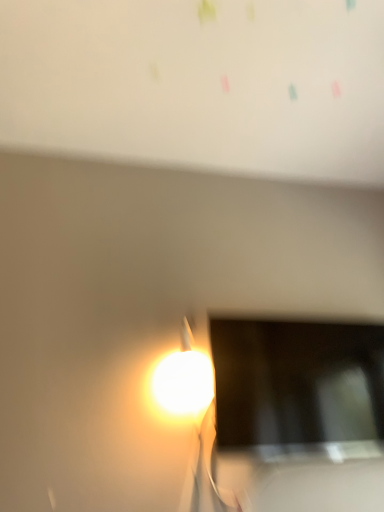
Measure the distance between point (322, 358) and camera.

Point (322, 358) and camera are 4.59 feet apart from each other.

What do you see at coordinates (296, 382) in the screenshot?
I see `matte black screen at lower right` at bounding box center [296, 382].

The width and height of the screenshot is (384, 512). Identify the location of matte black screen at lower right. (296, 382).

What do you see at coordinates (199, 84) in the screenshot? The image size is (384, 512). I see `white matte bulletin board at upper center` at bounding box center [199, 84].

Where is `white matte bulletin board at upper center`? This screenshot has height=512, width=384. white matte bulletin board at upper center is located at coordinates (199, 84).

Find the location of a particular element. matte black screen at lower right is located at coordinates [296, 382].

Does white matte bulletin board at upper center appear on the right side of matte black screen at lower right?

In fact, white matte bulletin board at upper center is to the left of matte black screen at lower right.

Looking at this image, considering their positions, is white matte bulletin board at upper center located in front of or behind matte black screen at lower right?

Clearly, white matte bulletin board at upper center is in front of matte black screen at lower right.

Which is nearer, (96, 147) or (303, 410)?

Positioned in front is point (303, 410).

From the image's perspective, which object appears higher, white matte bulletin board at upper center or matte black screen at lower right?

white matte bulletin board at upper center.

From a real-world perspective, which object rests below the other?

matte black screen at lower right, from a real-world perspective.

Between white matte bulletin board at upper center and matte black screen at lower right, which one has larger width?

Wider between the two is white matte bulletin board at upper center.

Consider the image. Considering the sizes of objects white matte bulletin board at upper center and matte black screen at lower right in the image provided, who is taller, white matte bulletin board at upper center or matte black screen at lower right?

matte black screen at lower right.

Does white matte bulletin board at upper center have a larger size compared to matte black screen at lower right?

Yes.

Would you say white matte bulletin board at upper center is inside or outside matte black screen at lower right?

white matte bulletin board at upper center is spatially situated outside matte black screen at lower right.

Does white matte bulletin board at upper center touch matte black screen at lower right?

white matte bulletin board at upper center and matte black screen at lower right are clearly separated.

Does white matte bulletin board at upper center turn towards matte black screen at lower right?

No, white matte bulletin board at upper center is not aimed at matte black screen at lower right.

How different are the orientations of white matte bulletin board at upper center and matte black screen at lower right in degrees?

white matte bulletin board at upper center and matte black screen at lower right are facing 90.2 degrees away from each other.

Locate an element on the screen. The height and width of the screenshot is (512, 384). bulletin board lying on the left of matte black screen at lower right is located at coordinates (199, 84).

Which object is positioned more to the left, matte black screen at lower right or white matte bulletin board at upper center?

From the viewer's perspective, white matte bulletin board at upper center appears more on the left side.

Considering the positions of objects matte black screen at lower right and white matte bulletin board at upper center in the image provided, who is behind, matte black screen at lower right or white matte bulletin board at upper center?

matte black screen at lower right is behind.

Is point (264, 391) farther from camera compared to point (192, 110)?

No, (264, 391) is in front of (192, 110).

From the image's perspective, is matte black screen at lower right above white matte bulletin board at upper center?

No.

From a real-world perspective, which object rests below the other?

matte black screen at lower right.

Considering the relative sizes of matte black screen at lower right and white matte bulletin board at upper center in the image provided, is matte black screen at lower right thinner than white matte bulletin board at upper center?

Yes, matte black screen at lower right is thinner than white matte bulletin board at upper center.

Considering the sizes of objects matte black screen at lower right and white matte bulletin board at upper center in the image provided, who is taller, matte black screen at lower right or white matte bulletin board at upper center?

Standing taller between the two is matte black screen at lower right.

Considering the sizes of matte black screen at lower right and white matte bulletin board at upper center in the image, is matte black screen at lower right bigger or smaller than white matte bulletin board at upper center?

Clearly, matte black screen at lower right is smaller in size than white matte bulletin board at upper center.

Is white matte bulletin board at upper center located within matte black screen at lower right?

Definitely not — white matte bulletin board at upper center is not inside matte black screen at lower right.

Is matte black screen at lower right directly adjacent to white matte bulletin board at upper center?

No, matte black screen at lower right is not in contact with white matte bulletin board at upper center.

Does matte black screen at lower right turn towards white matte bulletin board at upper center?

No, matte black screen at lower right is not facing towards white matte bulletin board at upper center.

Can you tell me how much matte black screen at lower right and white matte bulletin board at upper center differ in facing direction?

They differ by 90.2 degrees in their facing directions.

How far apart are matte black screen at lower right and white matte bulletin board at upper center?

matte black screen at lower right and white matte bulletin board at upper center are 32.79 inches apart from each other.

Locate an element on the screen. The width and height of the screenshot is (384, 512). computer screen lying behind the white matte bulletin board at upper center is located at coordinates [x=296, y=382].

Where is `computer screen below the white matte bulletin board at upper center (from the image's perspective)`? The height and width of the screenshot is (512, 384). computer screen below the white matte bulletin board at upper center (from the image's perspective) is located at coordinates (296, 382).

Identify the location of computer screen behind the white matte bulletin board at upper center. Image resolution: width=384 pixels, height=512 pixels. (296, 382).